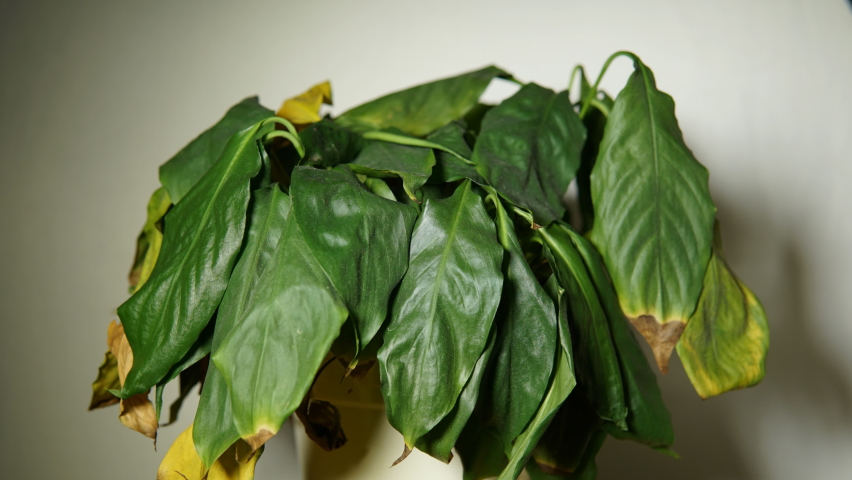
Where is `wilted plant`? This screenshot has width=852, height=480. wilted plant is located at coordinates (406, 179).